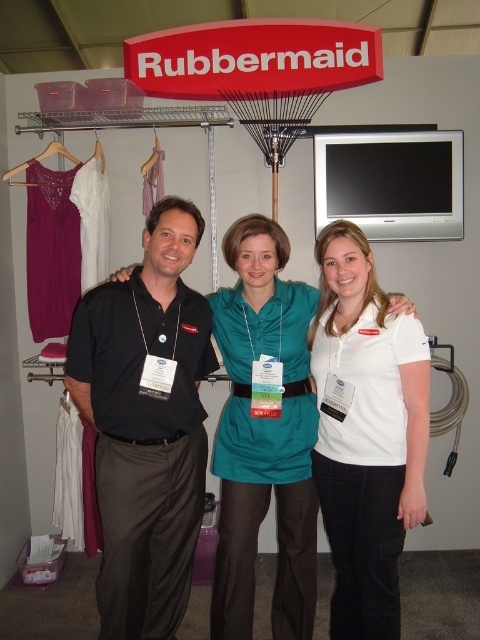
You are a vendor at the Rubbermaid booth and need to hand out a promotional item to the person wearing the white cotton polo shirt at center. The promotional item is placed on the purple fabric hanger at left. Can you reach the item without moving from your current position if your arm can extend 1.5 meters?

The distance between the white cotton polo shirt at center and the purple fabric hanger at left is 1.74 meters, which is longer than your arm extension of 1.5 meters. Therefore, you cannot reach the promotional item on the purple fabric hanger at left without moving.

What is the color of the clothing item located at point (365,433)?

The clothing item at point (365,433) is white cotton polo shirt.

You are at a Rubbermaid display at a trade show and see a white cotton polo shirt at center and a purple fabric hanger at left. Which one is positioned more to the right side?

The white cotton polo shirt at center is positioned more to the right side than the purple fabric hanger at left.